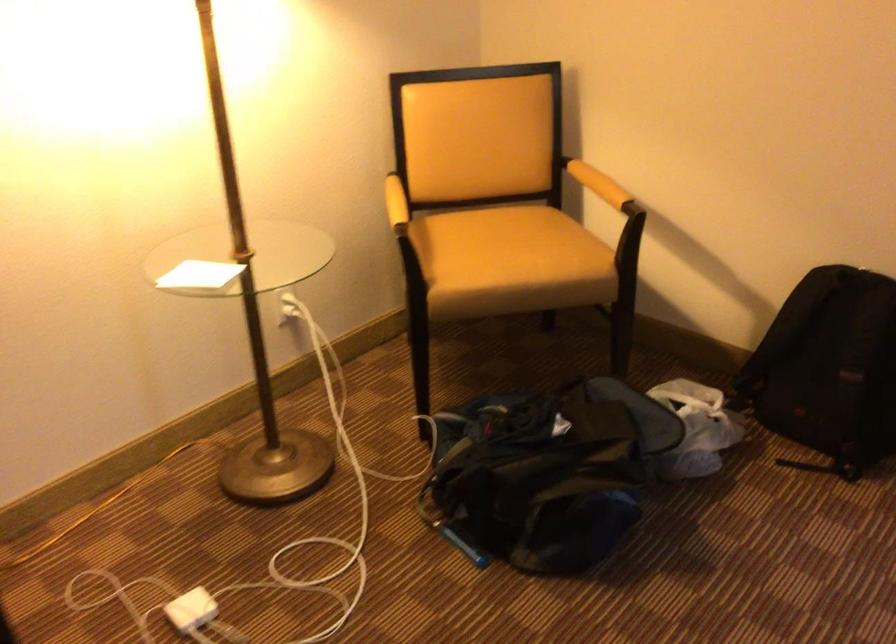
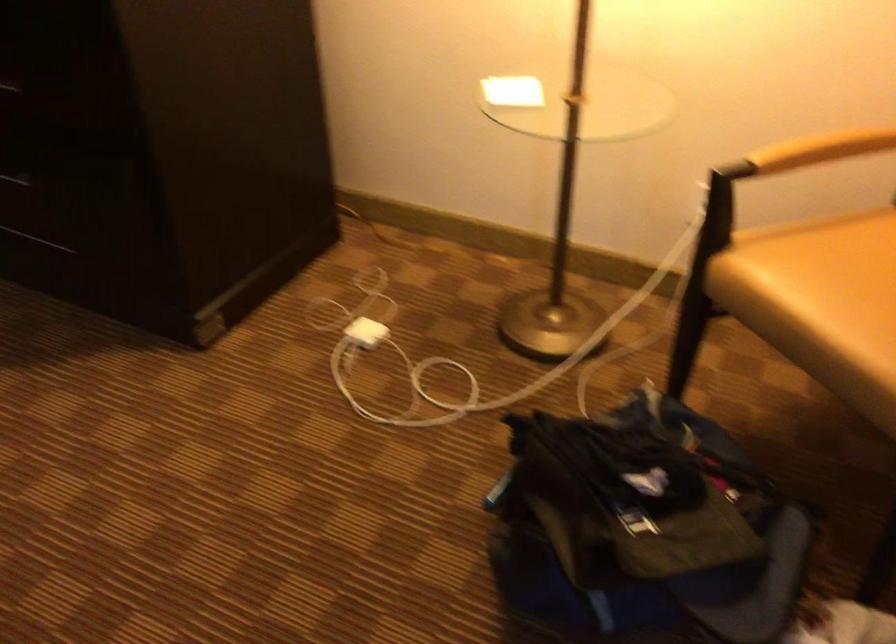
Where in the second image is the point corresponding to point 202,270 from the first image?

(513, 91)